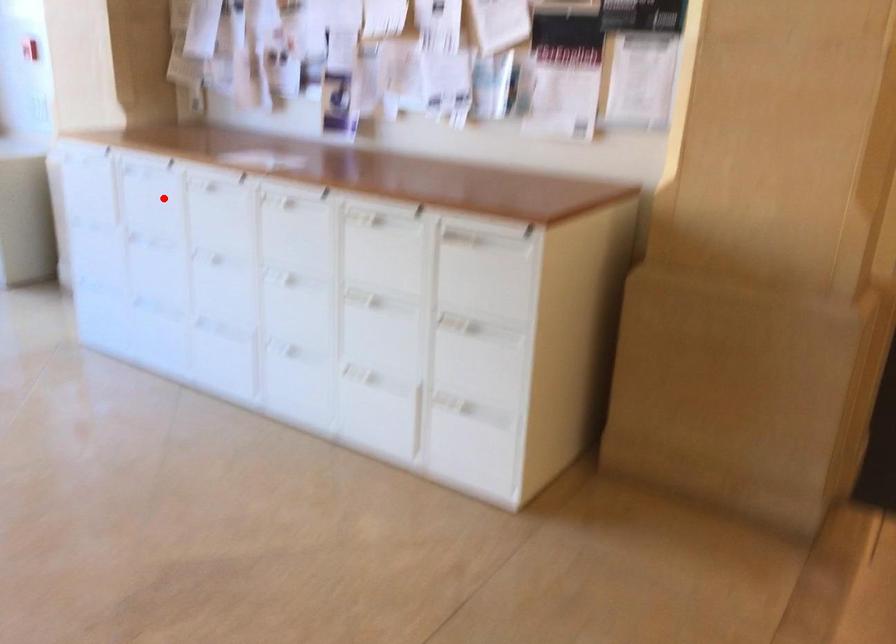
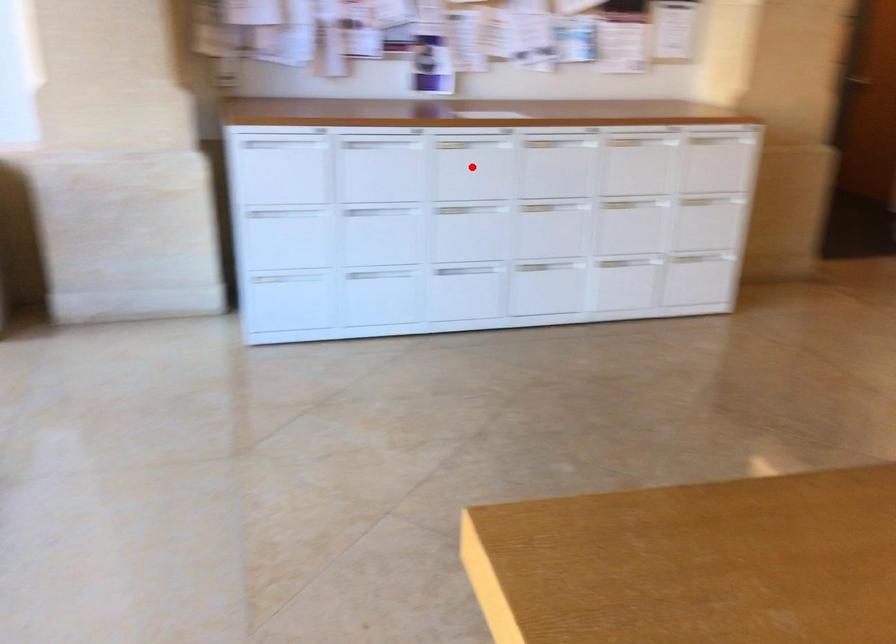
I am providing you with two images of the same scene from different viewpoints. A red point is marked on the first image and another point is marked on the second image. Does the point marked in image1 correspond to the same location as the one in image2?

No